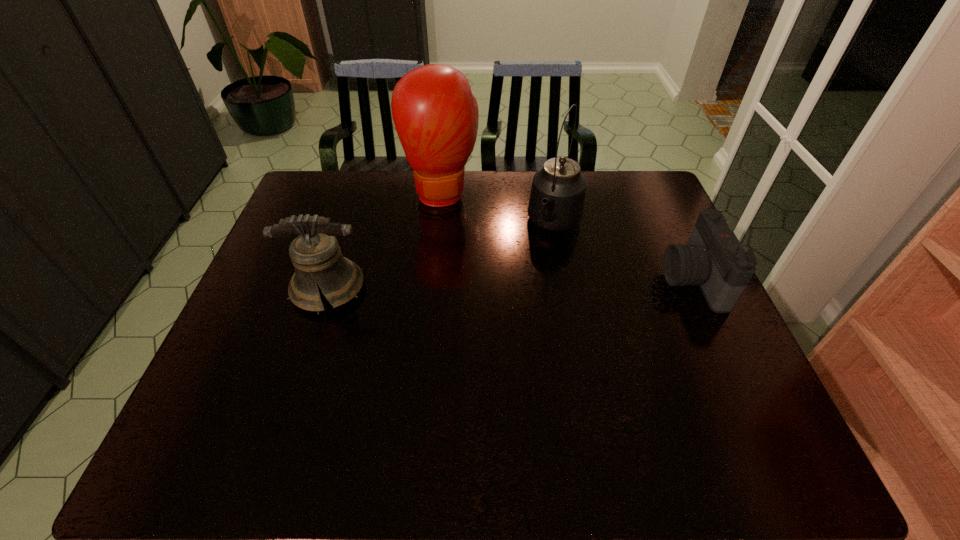
In the image, there is a desktop. Where is `blank space at the far edge`? This screenshot has height=540, width=960. blank space at the far edge is located at coordinates click(x=509, y=171).

This screenshot has height=540, width=960. I want to click on free point at the near edge, so click(319, 379).

Locate an element on the screen. The image size is (960, 540). free space at the left edge of the desktop is located at coordinates (274, 338).

The width and height of the screenshot is (960, 540). What are the coordinates of `free space at the right edge of the desktop` in the screenshot? It's located at (686, 295).

In the image, there is a desktop. Identify the location of vacant space at the far left corner. This screenshot has width=960, height=540. (315, 183).

The height and width of the screenshot is (540, 960). Find the location of `vacant space at the far right corner of the desktop`. vacant space at the far right corner of the desktop is located at coordinates (632, 199).

The image size is (960, 540). I want to click on vacant region between the camera and the third tallest object, so click(511, 284).

Locate an element on the screen. The image size is (960, 540). vacant point located between the leftmost object and the kettle is located at coordinates (442, 256).

Find the location of a particular element. vacant space that's between the third tallest object and the camera is located at coordinates (511, 284).

Where is `vacant area that lies between the third object from left to right and the second object from left to right`? This screenshot has width=960, height=540. vacant area that lies between the third object from left to right and the second object from left to right is located at coordinates (499, 209).